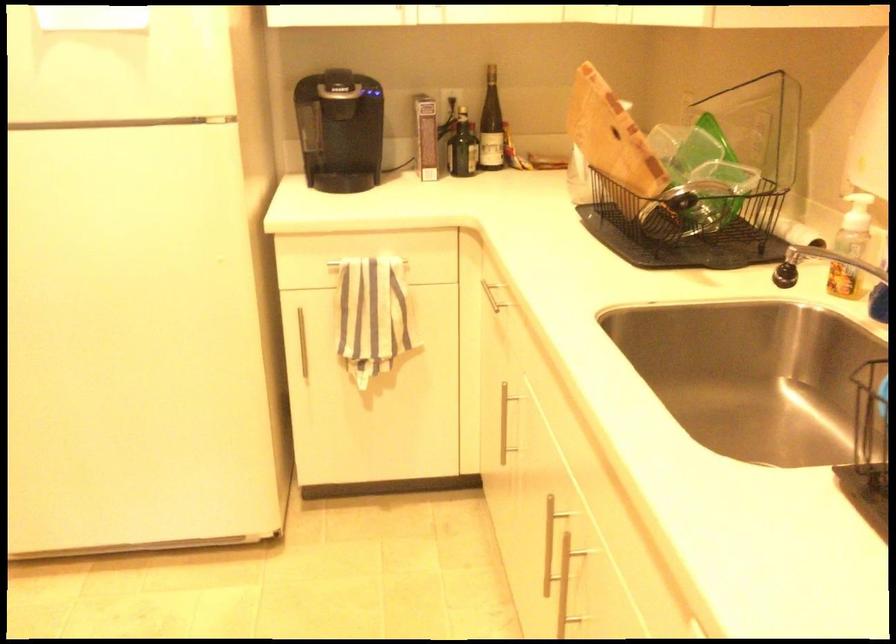
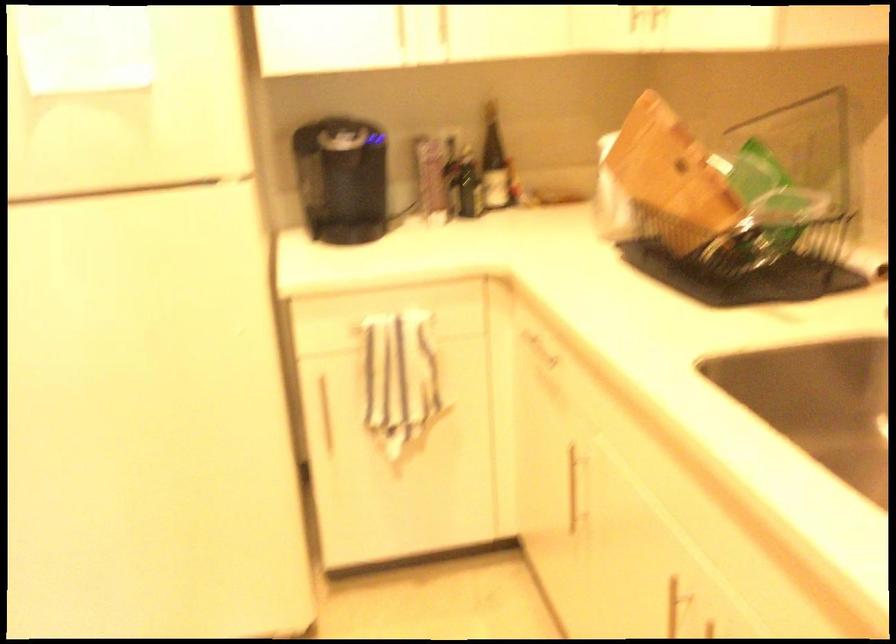
Which direction would the cameraman need to move to produce the second image?

The cameraman moved toward left, forward.